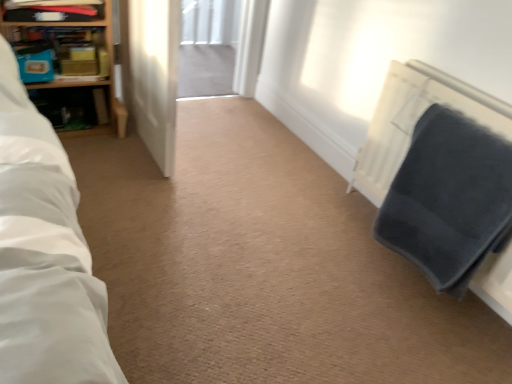
Question: From the image's perspective, is wooden shelf at upper left, which appears as the 1th shelf when viewed from the top, above transparent glass screen door at center?

Choices:
 (A) yes
 (B) no

Answer: (A)

Question: Can you confirm if wooden shelf at upper left, which is the 2th shelf in bottom-to-top order, is positioned to the right of transparent glass screen door at center?

Choices:
 (A) yes
 (B) no

Answer: (B)

Question: Is wooden shelf at upper left, which is the 2th shelf in bottom-to-top order, not within transparent glass screen door at center?

Choices:
 (A) no
 (B) yes

Answer: (B)

Question: From the image's perspective, is wooden shelf at upper left, which is the 2th shelf in bottom-to-top order, located beneath transparent glass screen door at center?

Choices:
 (A) yes
 (B) no

Answer: (B)

Question: From a real-world perspective, does wooden shelf at upper left, which is the 2th shelf in bottom-to-top order, stand above transparent glass screen door at center?

Choices:
 (A) no
 (B) yes

Answer: (B)

Question: Does wooden shelf at upper left, which is the 2th shelf in bottom-to-top order, have a lesser width compared to transparent glass screen door at center?

Choices:
 (A) yes
 (B) no

Answer: (A)

Question: From a real-world perspective, is wooden bookshelf at upper left, acting as the second shelf starting from the top, physically above wooden bookcase at upper left?

Choices:
 (A) no
 (B) yes

Answer: (B)

Question: Is wooden bookshelf at upper left, which is counted as the 1th shelf, starting from the bottom, turned away from wooden bookcase at upper left?

Choices:
 (A) no
 (B) yes

Answer: (B)

Question: Considering the relative sizes of wooden bookshelf at upper left, which is counted as the 1th shelf, starting from the bottom, and wooden bookcase at upper left in the image provided, is wooden bookshelf at upper left, which is counted as the 1th shelf, starting from the bottom, shorter than wooden bookcase at upper left?

Choices:
 (A) no
 (B) yes

Answer: (B)

Question: Does wooden bookshelf at upper left, which is counted as the 1th shelf, starting from the bottom, have a greater height compared to wooden bookcase at upper left?

Choices:
 (A) yes
 (B) no

Answer: (B)

Question: From the image's perspective, does wooden bookshelf at upper left, acting as the second shelf starting from the top, appear lower than wooden bookcase at upper left?

Choices:
 (A) no
 (B) yes

Answer: (A)

Question: Is wooden bookshelf at upper left, acting as the second shelf starting from the top, to the left of wooden bookcase at upper left from the viewer's perspective?

Choices:
 (A) yes
 (B) no

Answer: (B)

Question: From a real-world perspective, is wooden shelf at upper left, which is the 2th shelf in bottom-to-top order, beneath dark grey textured blanket at right?

Choices:
 (A) yes
 (B) no

Answer: (B)